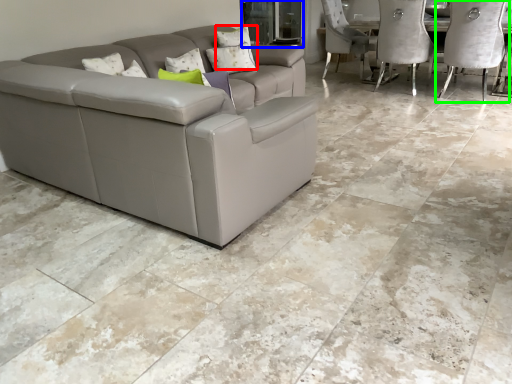
Question: Estimate the real-world distances between objects in this image. Which object is farther from pillow (highlighted by a red box), glass door (highlighted by a blue box) or chair (highlighted by a green box)?

Choices:
 (A) glass door
 (B) chair

Answer: (B)